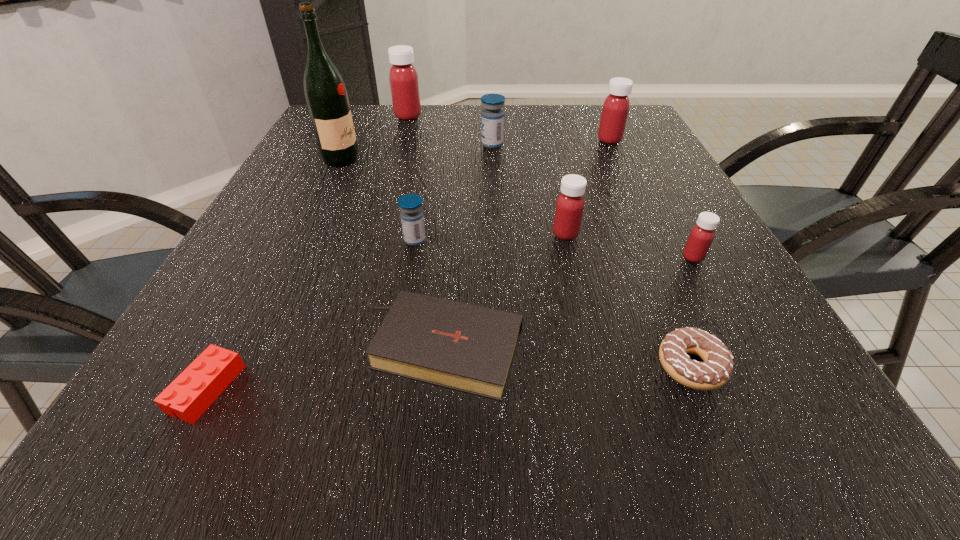
Find the location of `the tallest object`. the tallest object is located at coordinates (326, 95).

You are a GUI agent. You are given a task and a screenshot of the screen. Output one action in this format:
    pyautogui.click(x=<x>, y=<y>)
    Task: Click on the green liquor
    This screenshot has height=540, width=960.
    Given the screenshot: What is the action you would take?
    pyautogui.click(x=326, y=95)

Locate an element on the screen. the leftmost red medicine is located at coordinates coord(403,76).

I want to click on the tallest medicine, so click(x=403, y=76).

I want to click on the third tallest object, so click(x=616, y=106).

Locate an element on the screen. The height and width of the screenshot is (540, 960). the second farthest red medicine is located at coordinates (616, 106).

Find the location of a particular element. Image resolution: width=960 pixels, height=540 pixels. the fourth medicine from right to left is located at coordinates (492, 117).

The image size is (960, 540). Identify the location of the bigger blue medicine. (492, 117).

This screenshot has height=540, width=960. Identify the location of the fourth medicine from left to right. pyautogui.click(x=570, y=203).

Where is `the second smallest red medicine`? The image size is (960, 540). the second smallest red medicine is located at coordinates 570,203.